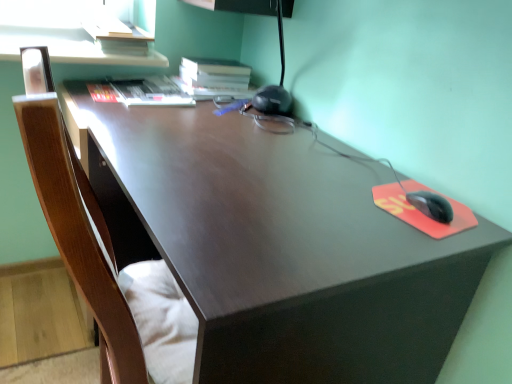
Question: From a real-world perspective, is hardcover book at upper left, the first book viewed from the left, on matte brown desk at center?

Choices:
 (A) yes
 (B) no

Answer: (A)

Question: Does hardcover book at upper left, the first book viewed from the left, have a greater height compared to matte brown desk at center?

Choices:
 (A) no
 (B) yes

Answer: (A)

Question: Would you consider hardcover book at upper left, the 2th book in the right-to-left sequence, to be distant from matte brown desk at center?

Choices:
 (A) yes
 (B) no

Answer: (B)

Question: From a real-world perspective, is hardcover book at upper left, the first book viewed from the left, beneath matte brown desk at center?

Choices:
 (A) yes
 (B) no

Answer: (B)

Question: Can you confirm if hardcover book at upper left, the first book viewed from the left, is positioned to the right of matte brown desk at center?

Choices:
 (A) yes
 (B) no

Answer: (B)

Question: Can you confirm if hardcover book at upper left, the first book viewed from the left, is wider than matte brown desk at center?

Choices:
 (A) yes
 (B) no

Answer: (B)

Question: Considering the relative positions of hardcover book at upper center, the second book viewed from the left, and matte brown desk at center in the image provided, is hardcover book at upper center, the second book viewed from the left, to the left of matte brown desk at center from the viewer's perspective?

Choices:
 (A) yes
 (B) no

Answer: (A)

Question: Considering the relative sizes of hardcover book at upper center, the second book viewed from the left, and matte brown desk at center in the image provided, is hardcover book at upper center, the second book viewed from the left, thinner than matte brown desk at center?

Choices:
 (A) yes
 (B) no

Answer: (A)

Question: Can you confirm if hardcover book at upper center, marked as the 1th book in a right-to-left arrangement, is taller than matte brown desk at center?

Choices:
 (A) no
 (B) yes

Answer: (A)

Question: Considering the relative positions of hardcover book at upper center, marked as the 1th book in a right-to-left arrangement, and matte brown desk at center in the image provided, is hardcover book at upper center, marked as the 1th book in a right-to-left arrangement, in front of matte brown desk at center?

Choices:
 (A) no
 (B) yes

Answer: (A)

Question: Is the depth of hardcover book at upper center, marked as the 1th book in a right-to-left arrangement, greater than that of matte brown desk at center?

Choices:
 (A) no
 (B) yes

Answer: (B)

Question: Would you say hardcover book at upper center, marked as the 1th book in a right-to-left arrangement, is outside matte brown desk at center?

Choices:
 (A) no
 (B) yes

Answer: (B)

Question: Does hardcover book at upper left, the 2th book in the right-to-left sequence, have a larger size compared to hardcover book at upper center, marked as the 1th book in a right-to-left arrangement?

Choices:
 (A) no
 (B) yes

Answer: (A)